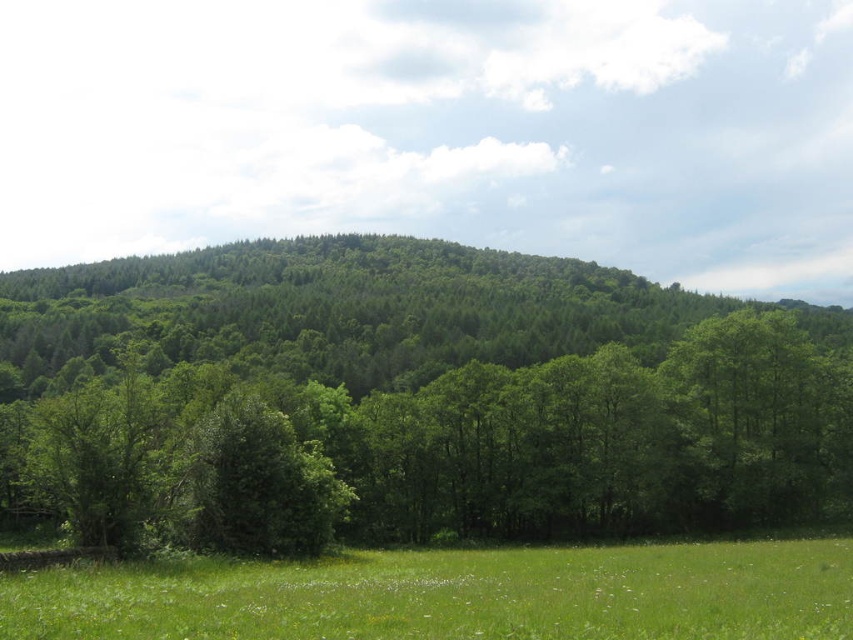
Question: Which point appears farthest from the camera in this image?

Choices:
 (A) (799, 636)
 (B) (318, 312)

Answer: (B)

Question: Is green leafy tree at center below green grassy field at lower center?

Choices:
 (A) no
 (B) yes

Answer: (A)

Question: Does green leafy tree at center lie behind green grassy field at lower center?

Choices:
 (A) no
 (B) yes

Answer: (B)

Question: Which point appears closest to the camera in this image?

Choices:
 (A) (334, 273)
 (B) (569, 616)

Answer: (B)

Question: Is green leafy tree at center closer to camera compared to green grassy field at lower center?

Choices:
 (A) no
 (B) yes

Answer: (A)

Question: Which point is closer to the camera taking this photo?

Choices:
 (A) (248, 339)
 (B) (792, 611)

Answer: (B)